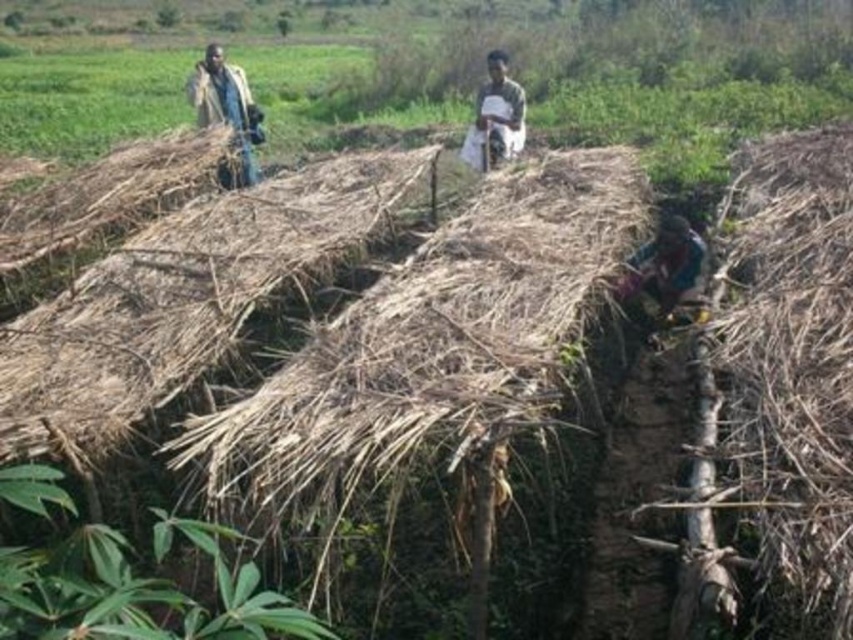
You are a farmer in the scene and need to place a small tool between the light brown fabric at upper left and the dark green fabric at center. Which fabric should the tool be closer to if it must stay within the space between them?

The tool should be closer to the dark green fabric at center because the light brown fabric at upper left is taller than the dark green fabric at center, so the space between them is closer to the shorter object.